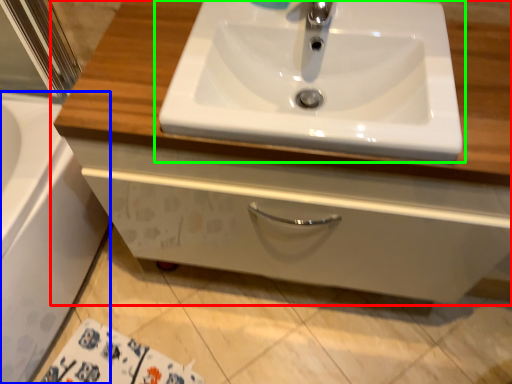
Question: Based on their relative distances, which object is nearer to bathroom cabinet (highlighted by a red box)? Choose from bath (highlighted by a blue box) and sink (highlighted by a green box).

Choices:
 (A) bath
 (B) sink

Answer: (B)